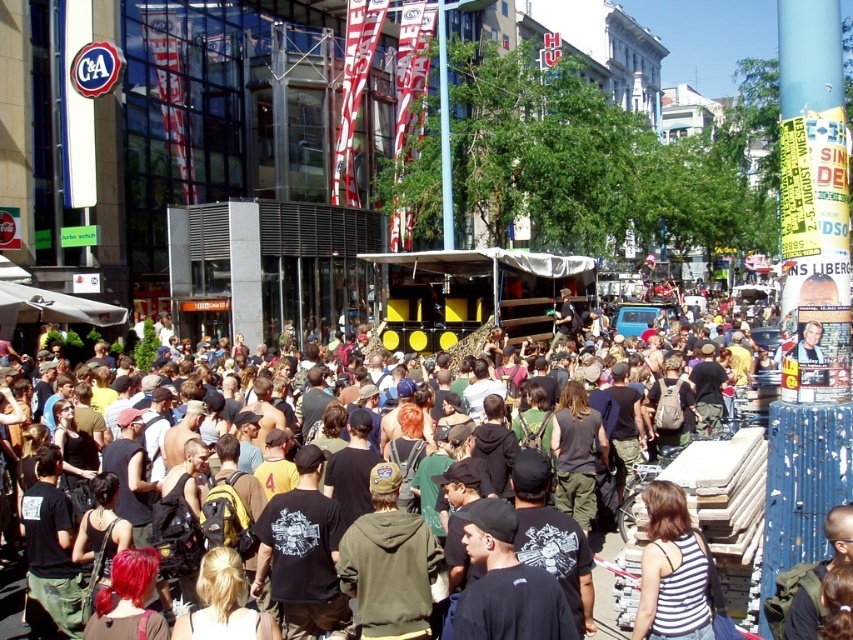
You are a photographer standing at the camera position in the scene. You want to capture a clear photo of the white striped tank top at lower center. Considering the distance, is it feasible to take a clear photo without zooming in?

The white striped tank top at lower center is 116.73 feet away from the camera. At this distance, capturing a clear photo without zooming in may be challenging due to the significant distance involved.

You are standing in the crowd at the urban event and want to reach the exit located at point (605, 593). There is an obstacle at point (679, 513). Can you go around it to reach the exit?

Point (679, 513) is in front of point (605, 593), so you cannot go around it directly. You need to find an alternative path to reach the exit.